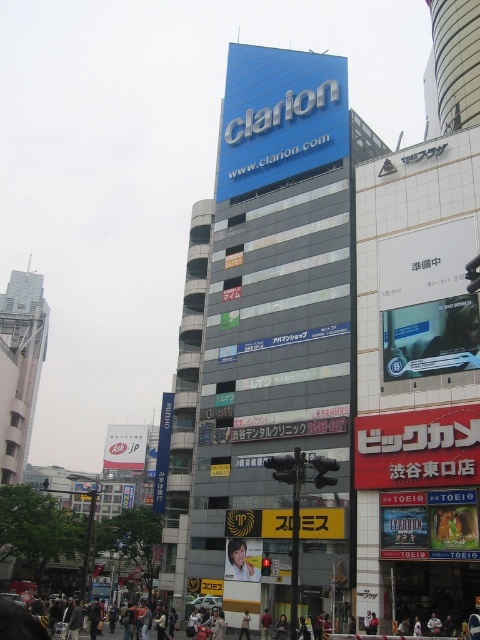
Based on the photo, is blue glossy sign at upper center closer to camera compared to light brown leather jacket at center?

That is False.

Is blue glossy sign at upper center shorter than light brown leather jacket at center?

Incorrect, blue glossy sign at upper center's height does not fall short of light brown leather jacket at center's.

Identify the location of blue glossy sign at upper center. The height and width of the screenshot is (640, 480). (279, 116).

Between point (248, 60) and point (260, 547), which one is positioned behind?

The point (248, 60) is behind.

The width and height of the screenshot is (480, 640). In order to click on blue glossy sign at upper center in this screenshot , I will do `click(279, 116)`.

Who is more forward, (322,80) or (228,557)?

Point (228,557) is more forward.

The height and width of the screenshot is (640, 480). I want to click on blue glossy sign at upper center, so click(279, 116).

Is the position of smooth plastic face at center more distant than that of light brown leather jacket at center?

That is True.

Between smooth plastic face at center and light brown leather jacket at center, which one appears on the right side from the viewer's perspective?

light brown leather jacket at center

Which is behind, point (255, 550) or point (245, 628)?

The point (255, 550) is more distant.

At what (x,y) coordinates should I click in order to perform the action: click on smooth plastic face at center. Please return your answer as a coordinate pair (x, y). This screenshot has width=480, height=640. Looking at the image, I should click on (242, 560).